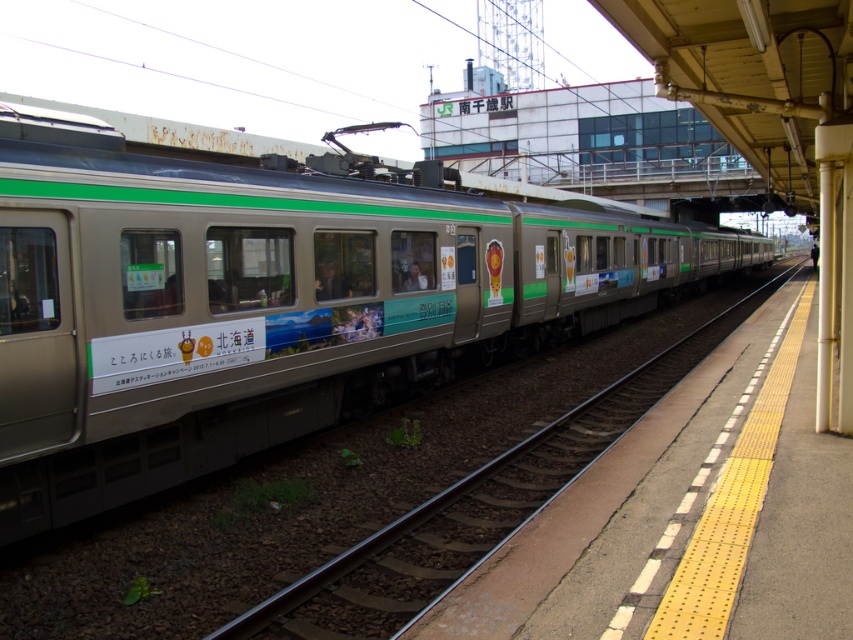
You are standing at the platform of the train station. There is a point marked at coordinate (270, 300). What object is located at that point?

The metallic silver train at center is represented by point (270, 300).

You are a photographer standing at the train station platform. You want to take a photo of the metallic silver train at center. If your camera has a minimum focusing distance of 5 meters, will you be able to take a clear photo without moving closer?

The metallic silver train at center is 5.19 meters from camera, which is just beyond the camera minimum focusing distance of 5 meters. Therefore, you will need to move slightly closer to ensure a clear photo.